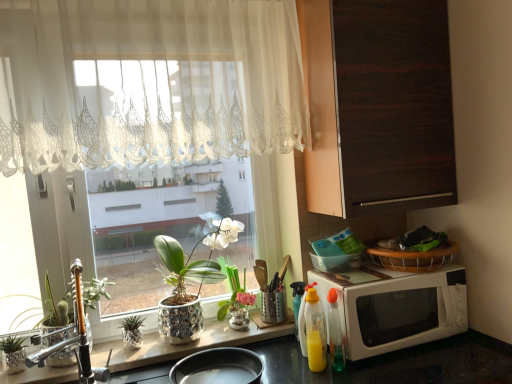
Question: Is yellow plastic bottle at lower center, which is counted as the third bottle, starting from the front, oriented away from translucent plastic bottle at lower right, which appears as the 2th bottle when viewed from the front?

Choices:
 (A) no
 (B) yes

Answer: (A)

Question: Can we say yellow plastic bottle at lower center, which is counted as the third bottle, starting from the front, lies outside translucent plastic bottle at lower right, which is counted as the third bottle, starting from the back?

Choices:
 (A) no
 (B) yes

Answer: (B)

Question: From a real-world perspective, is yellow plastic bottle at lower center, which is counted as the third bottle, starting from the front, physically below translucent plastic bottle at lower right, which is counted as the third bottle, starting from the back?

Choices:
 (A) yes
 (B) no

Answer: (B)

Question: Is yellow plastic bottle at lower center, which ranks as the 2th bottle in back-to-front order, bigger than translucent plastic bottle at lower right, which appears as the 2th bottle when viewed from the front?

Choices:
 (A) yes
 (B) no

Answer: (B)

Question: Is yellow plastic bottle at lower center, which is counted as the third bottle, starting from the front, taller than translucent plastic bottle at lower right, which appears as the 2th bottle when viewed from the front?

Choices:
 (A) yes
 (B) no

Answer: (A)

Question: Does point (125, 334) appear closer or farther from the camera than point (115, 112)?

Choices:
 (A) farther
 (B) closer

Answer: (A)

Question: From a real-world perspective, is translucent glass pineapple at lower center, the 3th houseplant in the right-to-left sequence, above or below white lace curtain at upper left?

Choices:
 (A) above
 (B) below

Answer: (B)

Question: Considering the positions of translucent glass pineapple at lower center, the 3th houseplant from the left, and white lace curtain at upper left in the image, is translucent glass pineapple at lower center, the 3th houseplant from the left, taller or shorter than white lace curtain at upper left?

Choices:
 (A) short
 (B) tall

Answer: (A)

Question: Based on their sizes in the image, would you say translucent glass pineapple at lower center, the 3th houseplant from the left, is bigger or smaller than white lace curtain at upper left?

Choices:
 (A) small
 (B) big

Answer: (A)

Question: Is green metallic plant at left, the 4th houseplant viewed from the right, wider or thinner than shiny metallic pan at lower center?

Choices:
 (A) thin
 (B) wide

Answer: (A)

Question: In the image, is green metallic plant at left, the 4th houseplant viewed from the right, positioned in front of or behind shiny metallic pan at lower center?

Choices:
 (A) front
 (B) behind

Answer: (B)

Question: In terms of size, does green metallic plant at left, the 4th houseplant viewed from the right, appear bigger or smaller than shiny metallic pan at lower center?

Choices:
 (A) small
 (B) big

Answer: (B)

Question: From the image's perspective, relative to shiny metallic pan at lower center, is green metallic plant at left, placed as the second houseplant when sorted from left to right, above or below?

Choices:
 (A) below
 (B) above

Answer: (B)

Question: In the image, is green metallic plant at left, the 4th houseplant viewed from the right, positioned in front of or behind dark wood cabinet at upper right?

Choices:
 (A) front
 (B) behind

Answer: (A)

Question: In terms of height, does green metallic plant at left, the 4th houseplant viewed from the right, look taller or shorter compared to dark wood cabinet at upper right?

Choices:
 (A) tall
 (B) short

Answer: (B)